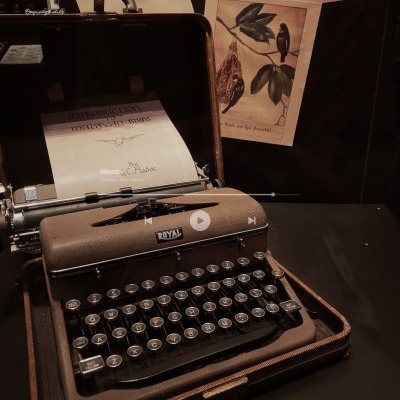
Where is `m key on the typewriter`? The height and width of the screenshot is (400, 400). m key on the typewriter is located at coordinates (225, 323).